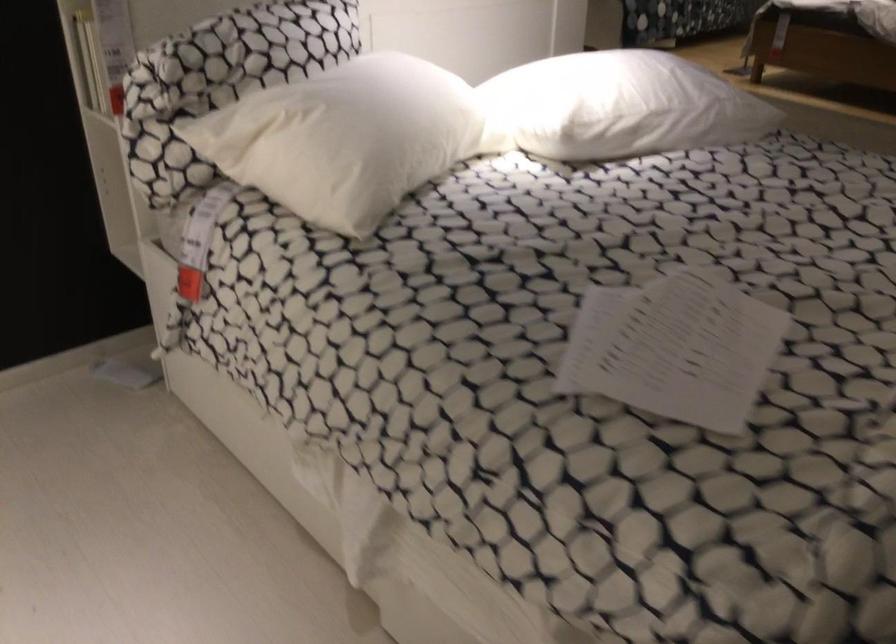
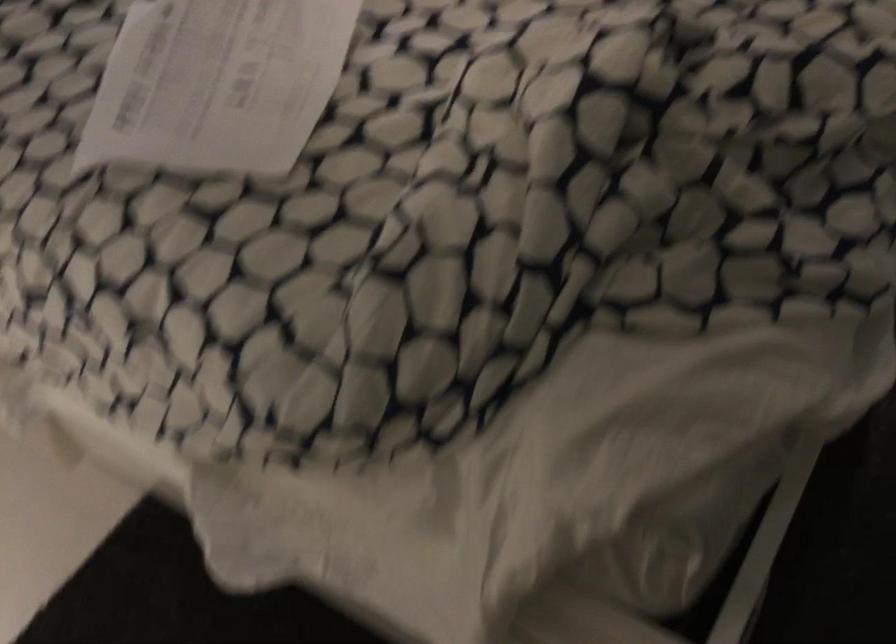
Question: How did the camera likely rotate?

Choices:
 (A) Left
 (B) Right
 (C) Up
 (D) Down

Answer: (D)